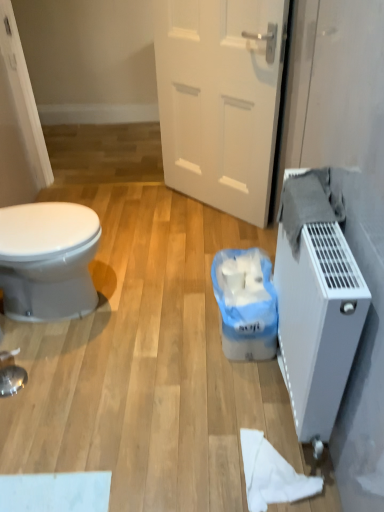
Question: From the image's perspective, would you say white plastic radiator at right is shown under white matte toilet paper at lower right?

Choices:
 (A) yes
 (B) no

Answer: (B)

Question: Is white plastic radiator at right positioned with its back to white matte toilet paper at lower right?

Choices:
 (A) yes
 (B) no

Answer: (B)

Question: Does white plastic radiator at right appear on the right side of white matte toilet paper at lower right?

Choices:
 (A) no
 (B) yes

Answer: (B)

Question: Is white plastic radiator at right wider than white matte toilet paper at lower right?

Choices:
 (A) no
 (B) yes

Answer: (A)

Question: Considering the relative sizes of white plastic radiator at right and white matte toilet paper at lower right in the image provided, is white plastic radiator at right bigger than white matte toilet paper at lower right?

Choices:
 (A) no
 (B) yes

Answer: (B)

Question: Is white plastic radiator at right far away from white matte toilet paper at lower right?

Choices:
 (A) yes
 (B) no

Answer: (B)

Question: Is white plastic radiator at right next to white plastic bag at lower center and touching it?

Choices:
 (A) yes
 (B) no

Answer: (B)

Question: From the image's perspective, is white plastic radiator at right located beneath white plastic bag at lower center?

Choices:
 (A) no
 (B) yes

Answer: (B)

Question: Can you confirm if white plastic radiator at right is smaller than white plastic bag at lower center?

Choices:
 (A) no
 (B) yes

Answer: (A)

Question: Is white plastic radiator at right positioned behind white plastic bag at lower center?

Choices:
 (A) yes
 (B) no

Answer: (B)

Question: From a real-world perspective, does white plastic radiator at right sit lower than white plastic bag at lower center?

Choices:
 (A) no
 (B) yes

Answer: (A)

Question: From the image's perspective, is white plastic radiator at right over white plastic bag at lower center?

Choices:
 (A) yes
 (B) no

Answer: (B)

Question: Is white matte door at center bigger than white matte toilet paper at lower right?

Choices:
 (A) no
 (B) yes

Answer: (B)